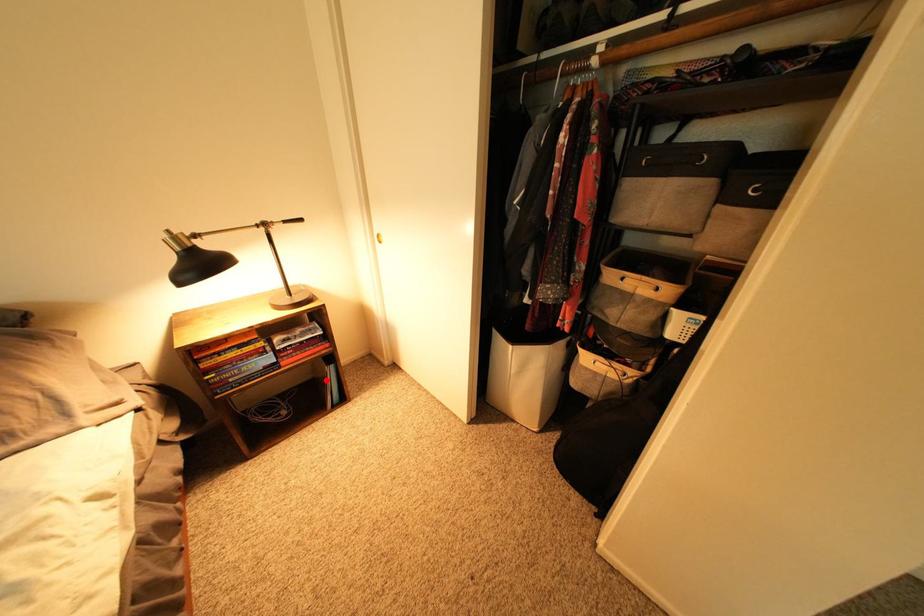
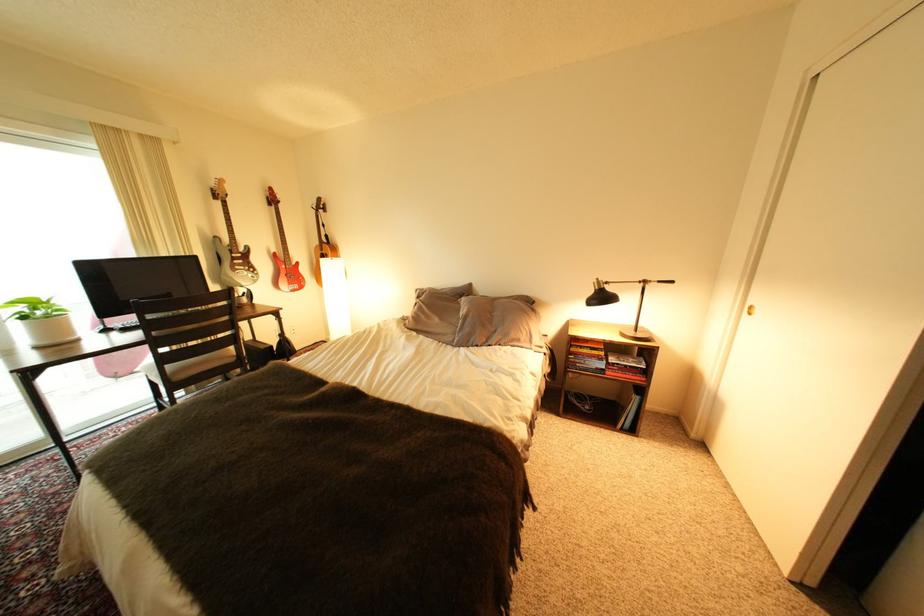
Question: A red point is marked in image1. In image2, is the corresponding 3D point closer to the camera or farther? Reply with the corresponding letter.

Choices:
 (A) The corresponding 3D point is closer.
 (B) The corresponding 3D point is farther.

Answer: (B)